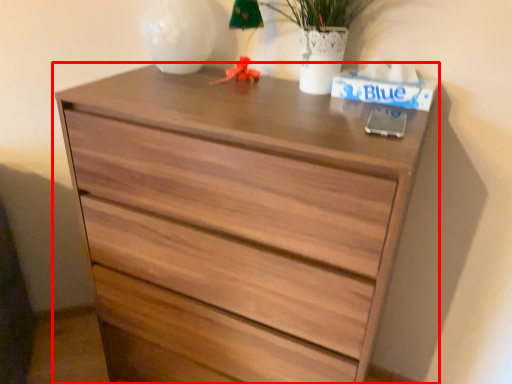
Question: From the image's perspective, considering the relative positions of chest of drawers (annotated by the red box) and table lamp in the image provided, where is chest of drawers (annotated by the red box) located with respect to the staircase?

Choices:
 (A) above
 (B) below

Answer: (B)